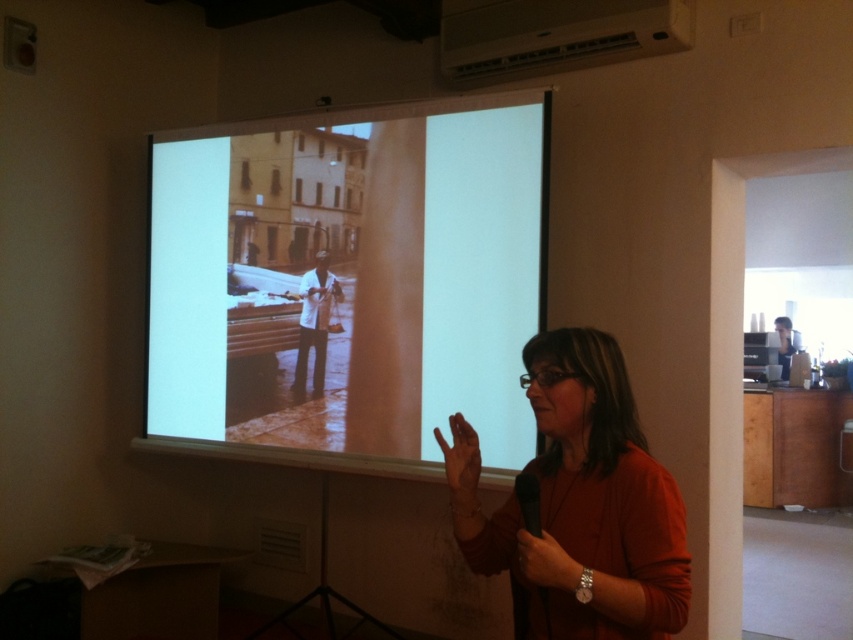
Question: Which point is closer to the camera?

Choices:
 (A) white plastic projector at upper center
 (B) smooth skin hand at center
 (C) white matte projection screen at center
 (D) smooth black hand at lower right

Answer: (D)

Question: Considering the relative positions of matte orange sweater at center and smooth skin hand at center in the image provided, where is matte orange sweater at center located with respect to smooth skin hand at center?

Choices:
 (A) left
 (B) right

Answer: (B)

Question: Among these objects, which one is nearest to the camera?

Choices:
 (A) matte orange sweater at center
 (B) white plastic projector at upper center
 (C) smooth black hand at lower right

Answer: (A)

Question: Does matte orange sweater at center appear under smooth skin hand at center?

Choices:
 (A) no
 (B) yes

Answer: (A)

Question: Is the position of white plastic projector at upper center more distant than that of smooth black hand at lower right?

Choices:
 (A) no
 (B) yes

Answer: (B)

Question: Estimate the real-world distances between objects in this image. Which object is closer to the matte orange sweater at center?

Choices:
 (A) white plastic projector at upper center
 (B) smooth black hand at lower right

Answer: (B)